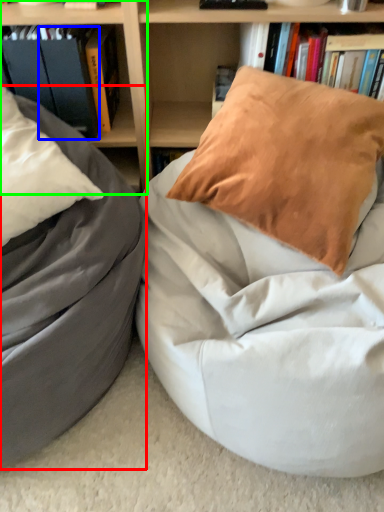
Question: Considering the real-world distances, which object is closest to bean bag chair (highlighted by a red box)? paperback book (highlighted by a blue box) or shelf (highlighted by a green box).

Choices:
 (A) paperback book
 (B) shelf

Answer: (A)